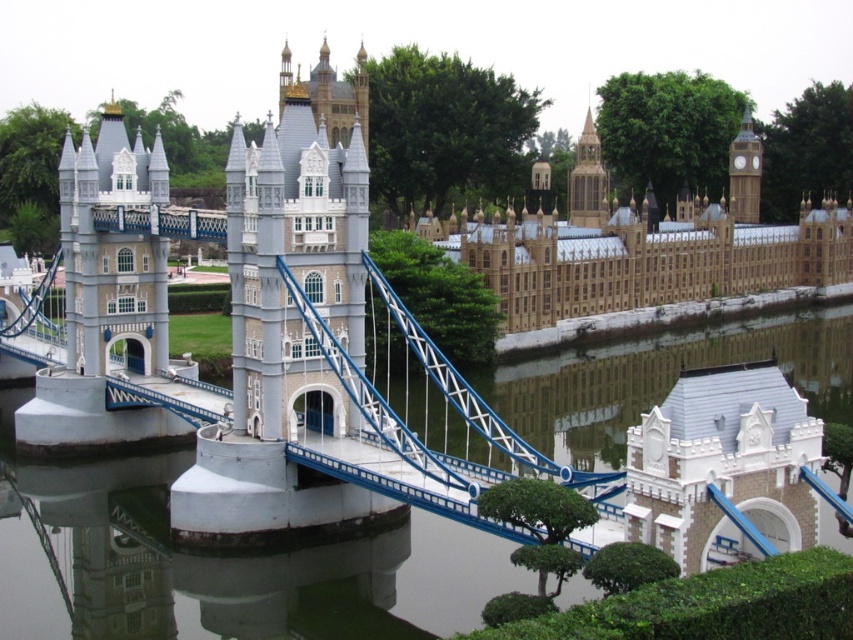
At what (x,y) coordinates should I click in order to perform the action: click on golden stone tower at upper center. Please return your answer as a coordinate pair (x, y). The width and height of the screenshot is (853, 640). Looking at the image, I should click on (587, 180).

Is point (590, 154) behind point (749, 221)?

No, (590, 154) is in front of (749, 221).

Find the location of a particular element. Image resolution: width=853 pixels, height=640 pixels. golden stone tower at upper center is located at coordinates (587, 180).

The image size is (853, 640). In order to click on golden stone tower at upper center in this screenshot , I will do `click(587, 180)`.

Based on the photo, is beige stone building at upper right bigger than golden stone tower at upper center?

Yes, beige stone building at upper right is bigger than golden stone tower at upper center.

Which is more to the right, beige stone building at upper right or golden stone tower at upper center?

golden stone tower at upper center is more to the right.

Image resolution: width=853 pixels, height=640 pixels. Describe the element at coordinates (637, 253) in the screenshot. I see `beige stone building at upper right` at that location.

Where is `beige stone building at upper right`? This screenshot has width=853, height=640. beige stone building at upper right is located at coordinates (637, 253).

Between beige stone building at upper right and golden stone clock tower at upper right, which one has more height?

With more height is beige stone building at upper right.

Which is in front, point (733, 244) or point (730, 184)?

Point (733, 244) is in front.

Locate an element on the screen. The image size is (853, 640). beige stone building at upper right is located at coordinates pyautogui.click(x=637, y=253).

Locate an element on the screen. This screenshot has height=640, width=853. beige stone building at upper right is located at coordinates (637, 253).